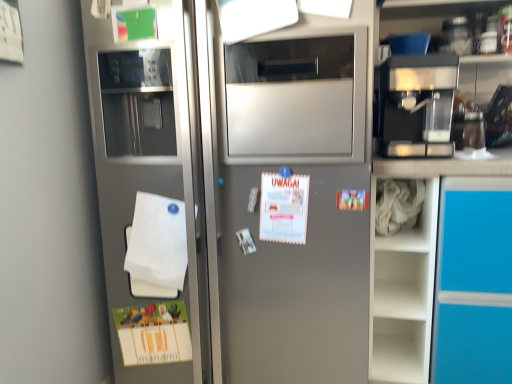
Question: Can you confirm if white matte notepad at lower left is positioned to the right of satin silver refrigerator at left?

Choices:
 (A) yes
 (B) no

Answer: (B)

Question: From a real-world perspective, is white matte notepad at lower left over satin silver refrigerator at left?

Choices:
 (A) no
 (B) yes

Answer: (A)

Question: Would you say white matte notepad at lower left is a long distance from satin silver refrigerator at left?

Choices:
 (A) no
 (B) yes

Answer: (A)

Question: Is white matte notepad at lower left taller than satin silver refrigerator at left?

Choices:
 (A) yes
 (B) no

Answer: (B)

Question: Is satin silver refrigerator at left inside white matte notepad at lower left?

Choices:
 (A) yes
 (B) no

Answer: (B)

Question: Considering the positions of white matte paper at upper center and satin silver refrigerator at left in the image, is white matte paper at upper center taller or shorter than satin silver refrigerator at left?

Choices:
 (A) short
 (B) tall

Answer: (A)

Question: From a real-world perspective, relative to satin silver refrigerator at left, is white matte paper at upper center vertically above or below?

Choices:
 (A) above
 (B) below

Answer: (A)

Question: Is white matte paper at upper center wider or thinner than satin silver refrigerator at left?

Choices:
 (A) thin
 (B) wide

Answer: (A)

Question: Is white matte paper at upper center inside the boundaries of satin silver refrigerator at left, or outside?

Choices:
 (A) outside
 (B) inside

Answer: (B)

Question: Is satin silver refrigerator at left taller or shorter than metallic espresso machine at upper right?

Choices:
 (A) tall
 (B) short

Answer: (A)

Question: In terms of width, does satin silver refrigerator at left look wider or thinner when compared to metallic espresso machine at upper right?

Choices:
 (A) thin
 (B) wide

Answer: (B)

Question: Relative to metallic espresso machine at upper right, is satin silver refrigerator at left in front or behind?

Choices:
 (A) front
 (B) behind

Answer: (A)

Question: From a real-world perspective, is satin silver refrigerator at left positioned above or below metallic espresso machine at upper right?

Choices:
 (A) below
 (B) above

Answer: (A)

Question: Relative to white fabric at right, is white matte paper at upper center in front or behind?

Choices:
 (A) front
 (B) behind

Answer: (A)

Question: Is point (266, 18) closer or farther from the camera than point (409, 248)?

Choices:
 (A) farther
 (B) closer

Answer: (B)